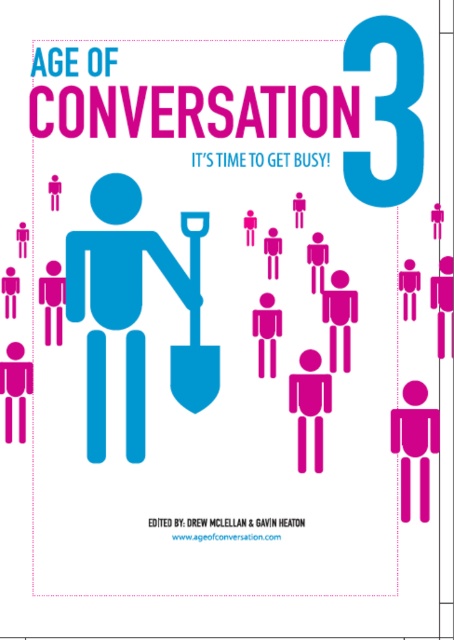
Question: Among these points, which one is farthest from the camera?

Choices:
 (A) (122, 321)
 (B) (172, 362)

Answer: (B)

Question: Is matte blue figure at center thinner than blue matte shovel at center?

Choices:
 (A) no
 (B) yes

Answer: (A)

Question: Which point is farther from the camera taking this photo?

Choices:
 (A) (206, 218)
 (B) (65, 262)

Answer: (A)

Question: Does matte blue figure at center come in front of blue matte shovel at center?

Choices:
 (A) no
 (B) yes

Answer: (B)

Question: Which point is closer to the camera?

Choices:
 (A) (105, 236)
 (B) (182, 387)

Answer: (B)

Question: Is matte blue figure at center below blue matte shovel at center?

Choices:
 (A) yes
 (B) no

Answer: (A)